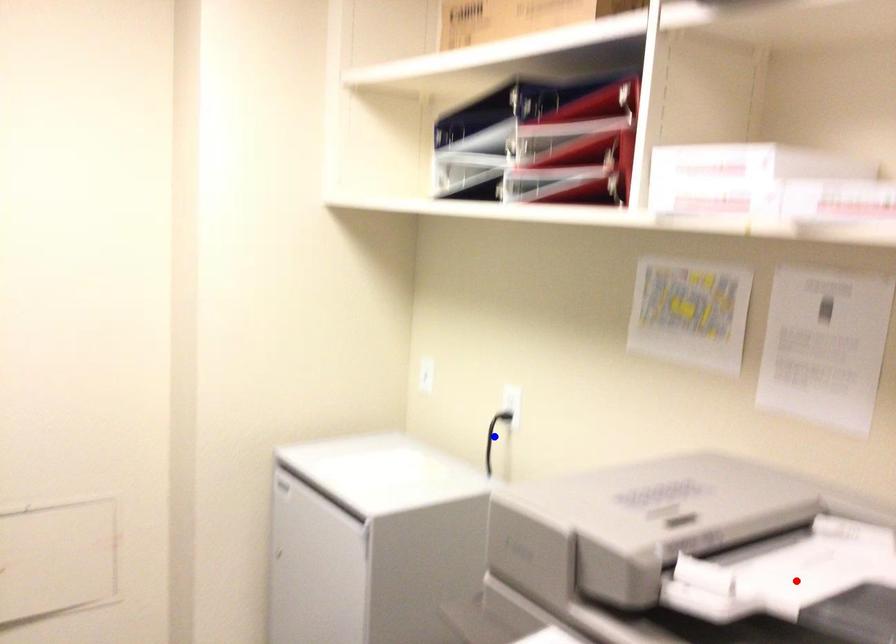
Question: Which of the two points in the image is closer to the camera?

Choices:
 (A) Blue point is closer.
 (B) Red point is closer.

Answer: (B)